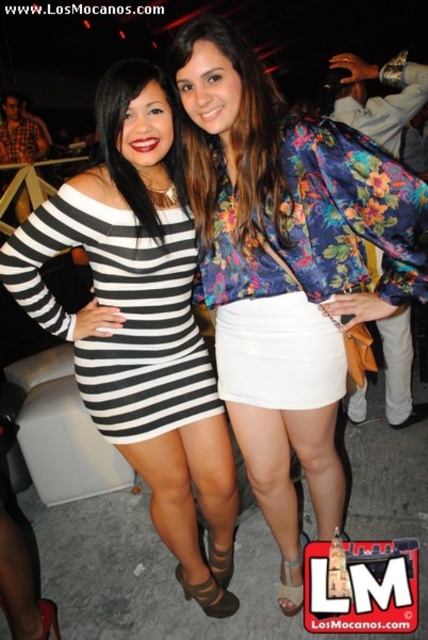
You are at a social event and want to find the black matte dress at center. Based on the coordinates provided in the scene description, can you determine its position relative to the two women described?

The black matte dress at center is located at coordinates point (140, 323), which places it centrally within the image frame, likely between the two women described in the scene.

You are a photographer at the event and want to ensure that the floral satin blouse at center is centered in the photo. Given that the image has a coordinate system where the bottom left corner is the origin, what adjustments should you make to the camera position to center the blouse?

The floral satin blouse at center is already centered at the point closest to the center of the image, which is the coordinate point given, so no adjustment is needed.